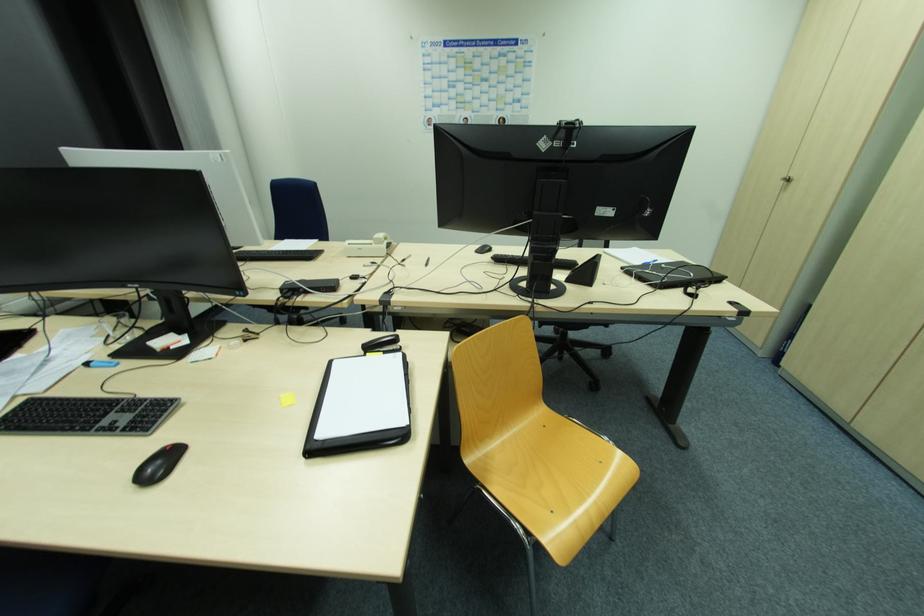
What are the coordinates of `yellow chair sitting surface` in the screenshot? It's located at (540, 464).